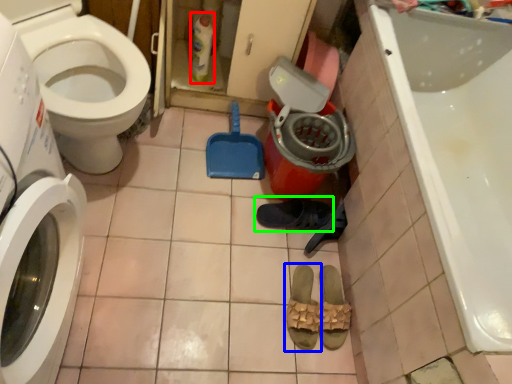
Question: Which is nearer to the cleaning product (highlighted by a red box)? footwear (highlighted by a blue box) or footwear (highlighted by a green box).

Choices:
 (A) footwear
 (B) footwear

Answer: (B)